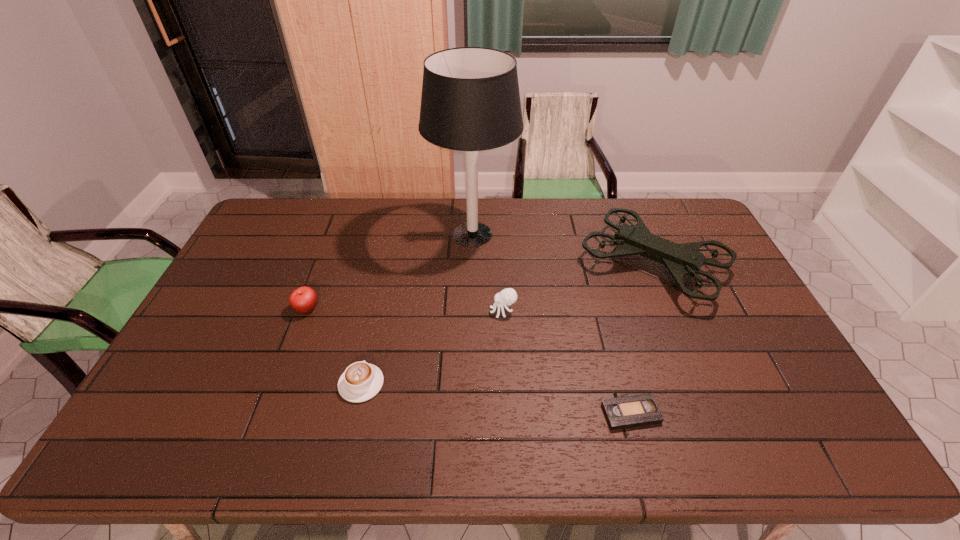
This screenshot has width=960, height=540. In order to click on object that is positioned at the right edge in this screenshot , I will do `click(684, 259)`.

The image size is (960, 540). What are the coordinates of `object at the far right corner` in the screenshot? It's located at (684, 259).

In the image, there is a desktop. Identify the location of vacant space at the far edge. This screenshot has width=960, height=540. (522, 204).

In order to click on free location at the near edge in this screenshot , I will do `click(225, 435)`.

What are the coordinates of `vacant space at the left edge of the desktop` in the screenshot? It's located at (212, 294).

The image size is (960, 540). In the image, there is a desktop. In order to click on vacant space at the right edge in this screenshot , I will do `click(722, 317)`.

Where is `vacant area at the near left corner of the desktop`? The image size is (960, 540). vacant area at the near left corner of the desktop is located at coordinates (192, 438).

At what (x,y) coordinates should I click in order to perform the action: click on vacant space at the far right corner of the desktop. Please return your answer as a coordinate pair (x, y). Looking at the image, I should click on (667, 221).

Where is `vacant space at the near right corner of the desktop`? The width and height of the screenshot is (960, 540). vacant space at the near right corner of the desktop is located at coordinates (791, 438).

Identify the location of free space between the drone and the octopus. (578, 288).